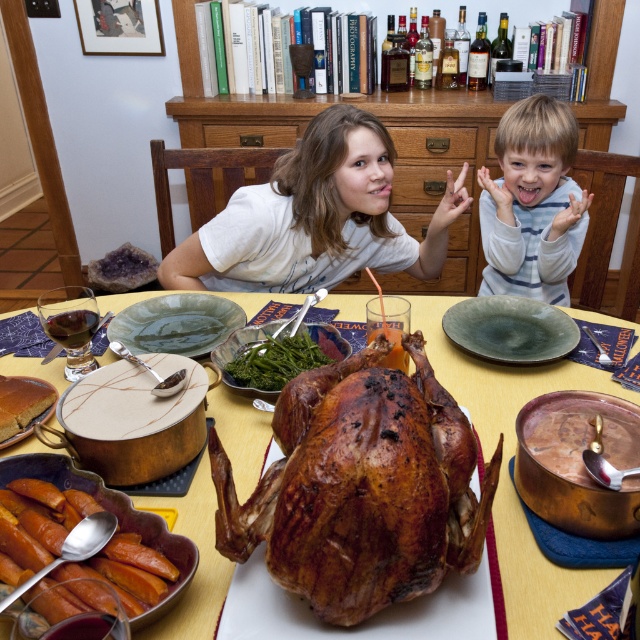
You are a guest at the table and want to reach for both the shiny orange glazed carrots at lower left and the green matte platter at center. Which of the two items is shorter?

The shiny orange glazed carrots at lower left has a lesser height compared to the green matte platter at center, so the shiny orange glazed carrots at lower left is shorter.

You are a guest at this festive table and want to reach for the shiny orange glazed carrots at lower left. Which direction should you move relative to the green matte platter at center?

The shiny orange glazed carrots at lower left are located below the green matte platter at center, so you should move downward or toward the lower part of the table to reach them.

You are a guest at this festive table and want to reach for the shiny copper pot at center without knocking over the matte white shirt at center. Considering their sizes, which one is taller and requires more caution to avoid?

The matte white shirt at center is taller than the shiny copper pot at center, so you should be more cautious around the matte white shirt at center to avoid knocking it over.